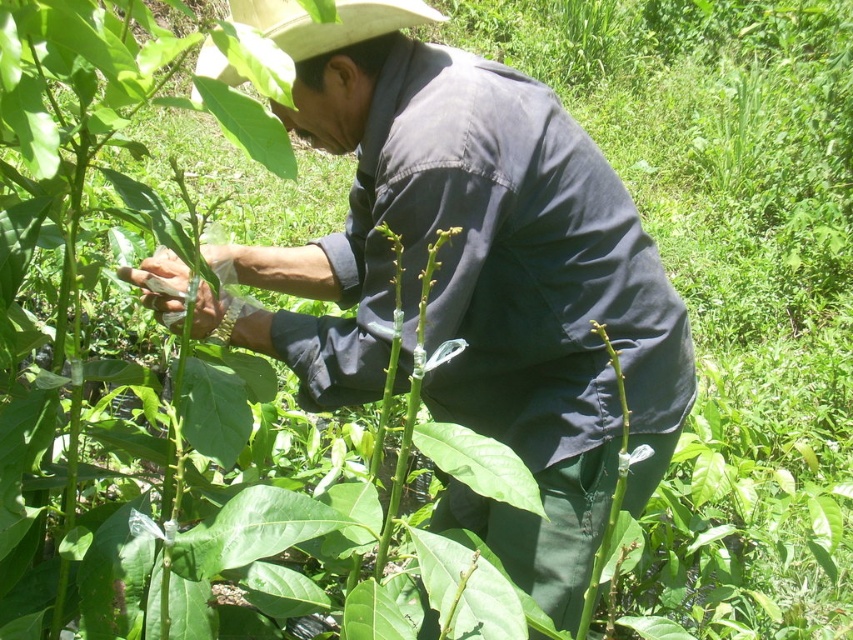
Who is more forward, (316, 337) or (276, 19)?

Point (276, 19)

Who is positioned more to the right, dark blue shirt at center or white straw cowboy hat at upper center?

Positioned to the right is dark blue shirt at center.

Which is in front, point (508, 202) or point (199, 61)?

Point (508, 202) is in front.

Find the location of a particular element. dark blue shirt at center is located at coordinates (473, 278).